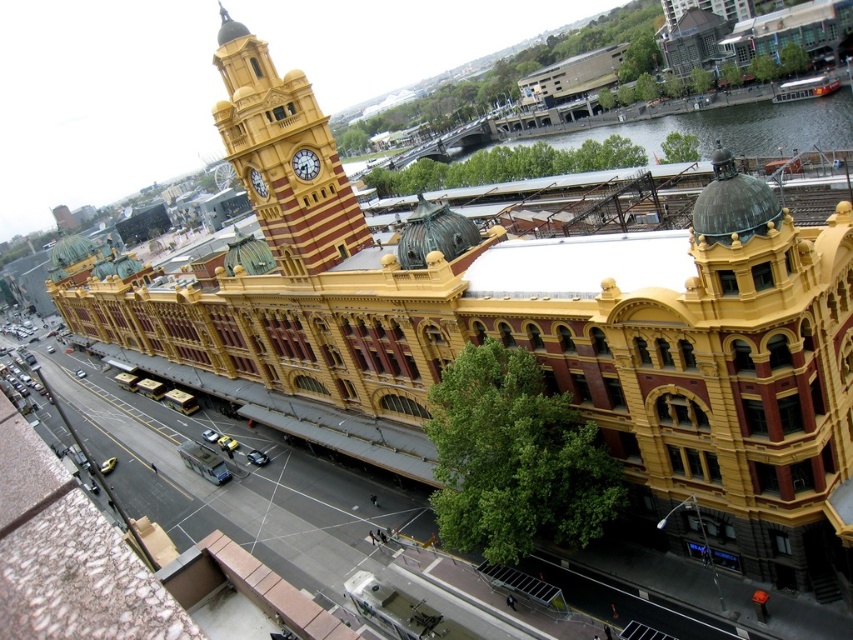
You are a city planner assessing the view from the main road. You need to determine if the green water at upper right takes up more horizontal space than the gold metallic clock at center. Can you confirm this?

The green water at upper right is wider than the gold metallic clock at center, so yes, the green water at upper right does take up more horizontal space than the gold metallic clock at center.

You are a tourist standing in front of the historic building. You notice the green water at upper right and the gold metallic clock at center. Which object takes up more space in the image?

The green water at upper right takes up more space in the image than the gold metallic clock at center because it is bigger.

You are a city planner reviewing this area. You need to determine which object occupies more space in the upper regions of the image for zoning purposes. Which one is larger between the green water at upper right and the gold metallic clock at upper center?

The green water at upper right is bigger than the gold metallic clock at upper center, so it occupies more space in the upper regions of the image.